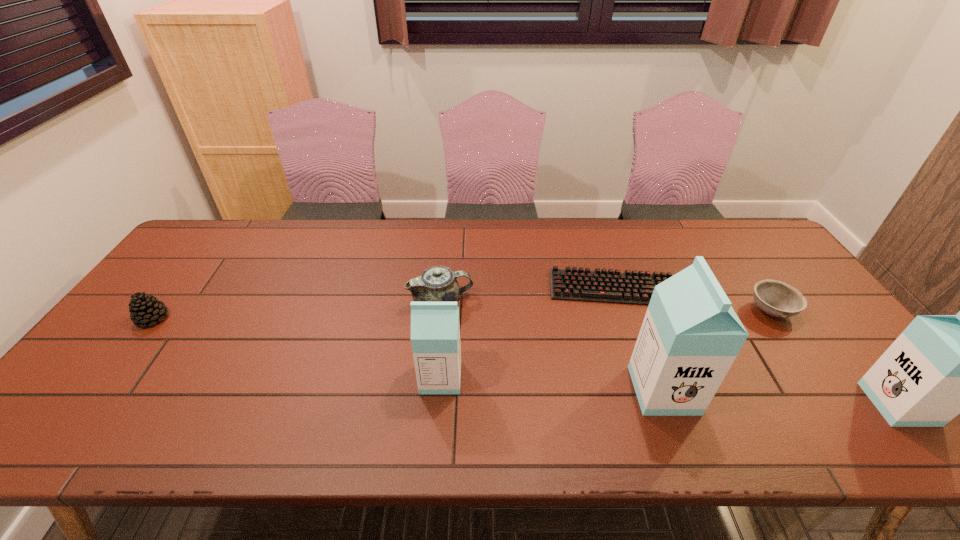
The width and height of the screenshot is (960, 540). Find the location of `the shortest object`. the shortest object is located at coordinates (629, 287).

I want to click on free space located 0.140m on the left of the shortest milk carton, so click(363, 377).

Locate an element on the screen. free space located 0.200m on the left of the second milk carton from left to right is located at coordinates (550, 390).

Where is `vacant area situated 0.300m on the back of the rightmost object`? vacant area situated 0.300m on the back of the rightmost object is located at coordinates (811, 297).

The image size is (960, 540). In order to click on free space located 0.080m at the narrow end of the pinecone in this screenshot , I will do `click(126, 353)`.

This screenshot has width=960, height=540. What are the coordinates of `free space located on the left of the bowl` in the screenshot? It's located at (641, 312).

Locate an element on the screen. free location located from the spout of the fourth tallest object is located at coordinates (598, 301).

Identify the location of vacant space located on the back of the computer keyboard. (604, 261).

Locate an element on the screen. This screenshot has width=960, height=540. object positioned at the left edge is located at coordinates (144, 309).

At what (x,y) coordinates should I click in order to perform the action: click on milk carton situated at the right edge. Please return your answer as a coordinate pair (x, y). Image resolution: width=960 pixels, height=540 pixels. Looking at the image, I should click on (940, 366).